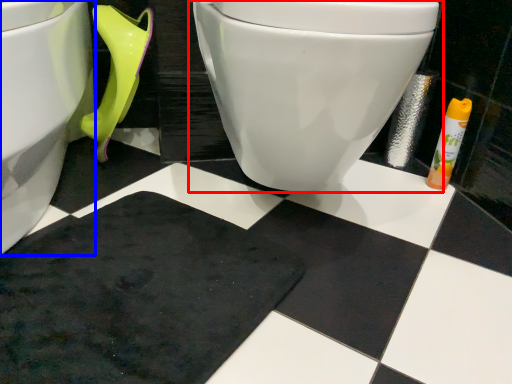
Question: Among these objects, which one is farthest to the camera, toilet (highlighted by a red box) or toilet (highlighted by a blue box)?

Choices:
 (A) toilet
 (B) toilet

Answer: (A)